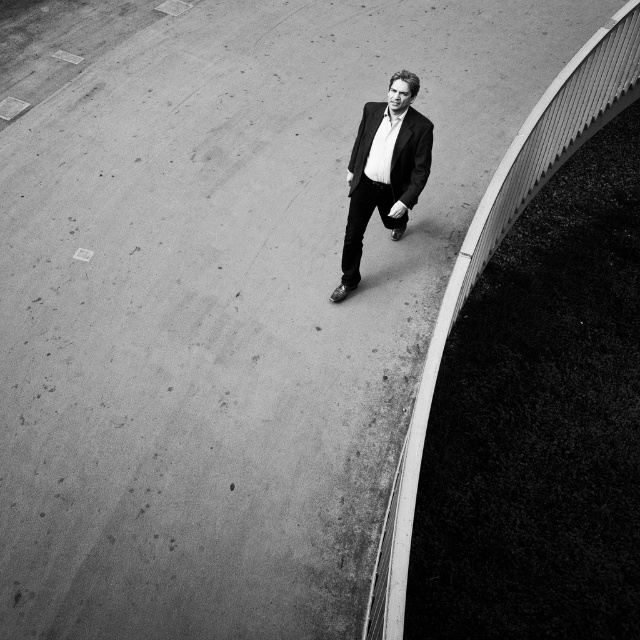
You are standing at the edge of a curved concrete surface and want to reach the point marked as point (573, 134). If you take a step forward, how far will you be from that point?

The distance between point (573, 134) and the viewer is 7.47 meters. Taking a step forward would reduce this distance, but the exact new distance cannot be determined without knowing the length of your step.

You are a photographer analyzing the composition of this image. The smooth concrete curb at right and the matte black suit at center are both important elements. Which of these two objects occupies a larger area in the frame?

The matte black suit at center occupies a larger area in the frame than the smooth concrete curb at right.

From the picture: You are designing a safety barrier and need to know the relative widths of the smooth concrete curb at right and the matte black suit at center. Which object is narrower?

The smooth concrete curb at right is narrower than the matte black suit at center.